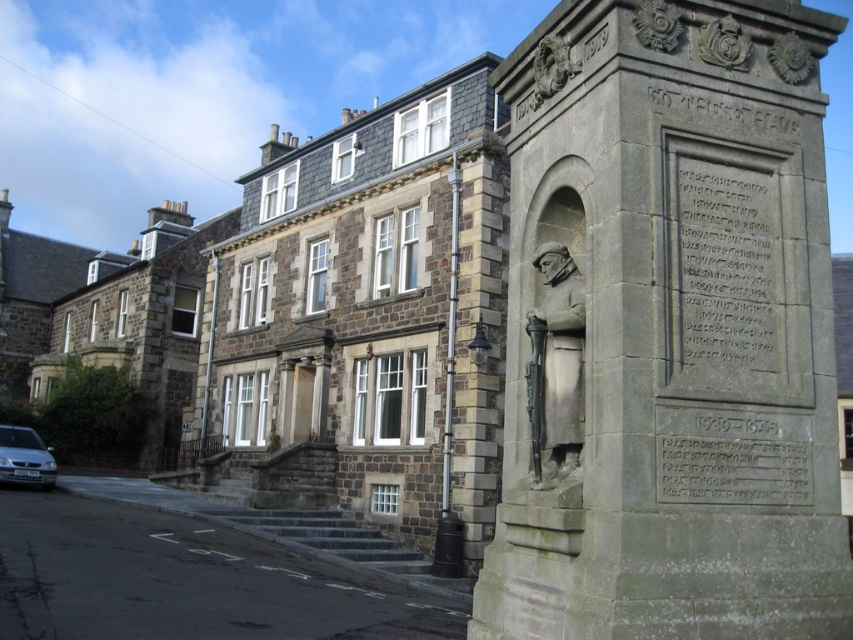
You are an architect visiting the building and want to take a photo of the bronze statue at center without the black stone inscription at center blocking the view. Is this possible from your current position in front of the building?

The black stone inscription at center is in front of the bronze statue at center, so taking a photo of the bronze statue at center without the black stone inscription at center blocking the view is not possible from your current position in front of the building.

Based on the photo, you are a visitor approaching the stone building from the front entrance. You see the bronze statue at right and the silver metallic car at lower left. Which object is positioned farther to the east?

The bronze statue at right is positioned farther to the east because it is to the right of the silver metallic car at lower left, and assuming the visitor is facing the building, right would correspond to the east direction.

What is located at the coordinates point (x=672, y=332)?

The bronze statue at right is located at point (x=672, y=332).